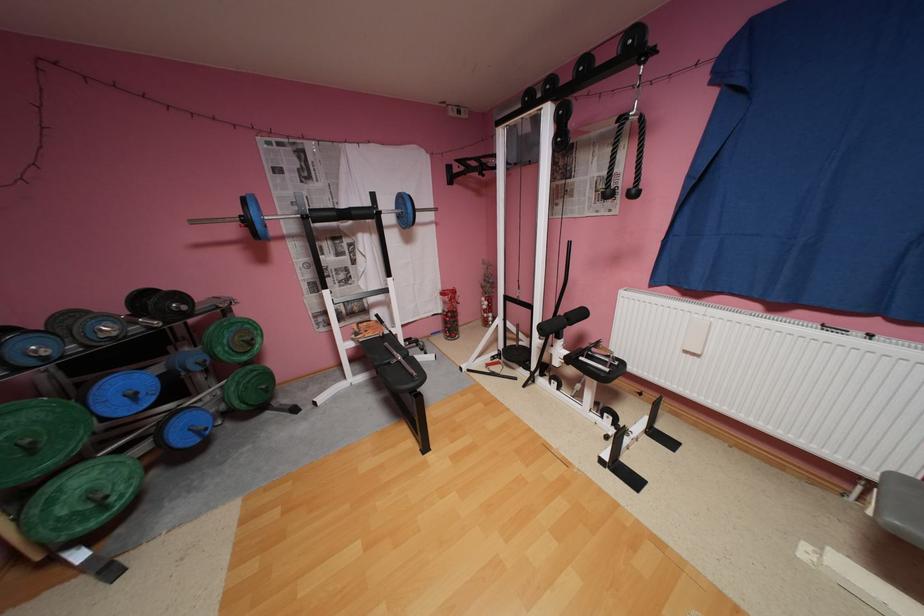
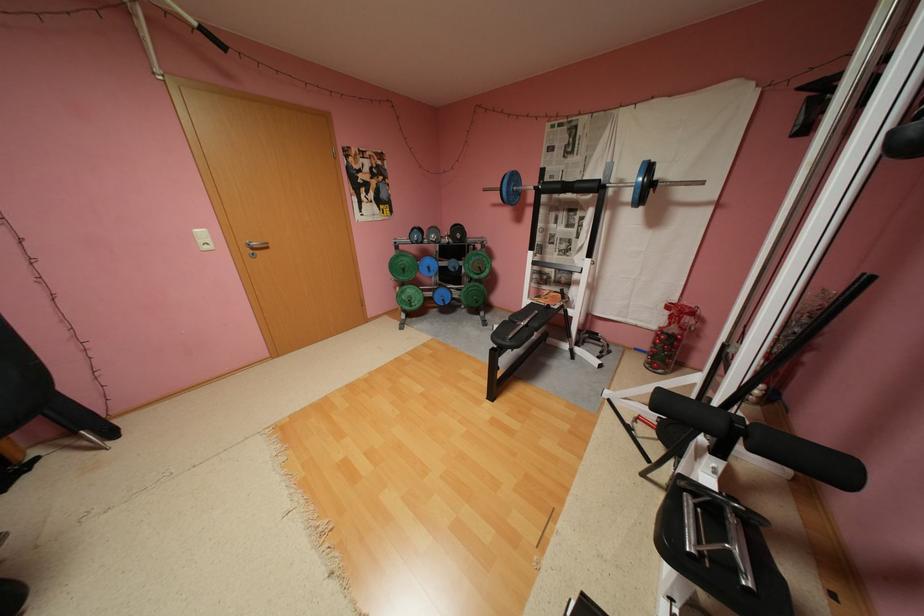
Where in the second image is the point corresponding to [362,213] from the first image?

(586, 185)